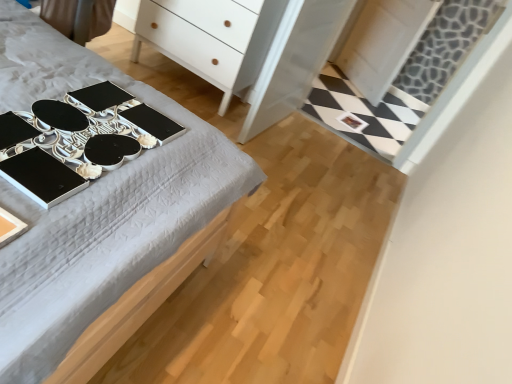
Question: From their relative heights in the image, would you say black glossy desk at upper left is taller or shorter than metallic silver changing table at upper left?

Choices:
 (A) short
 (B) tall

Answer: (B)

Question: Does point (214, 145) appear closer or farther from the camera than point (113, 165)?

Choices:
 (A) farther
 (B) closer

Answer: (A)

Question: Which object is positioned closest to the metallic silver changing table at upper left?

Choices:
 (A) black glossy desk at upper left
 (B) white glossy dresser at center
 (C) white matte chest of drawers at upper center

Answer: (A)

Question: Considering the real-world distances, which object is closest to the black glossy desk at upper left?

Choices:
 (A) white matte chest of drawers at upper center
 (B) metallic silver changing table at upper left
 (C) white glossy dresser at center

Answer: (B)